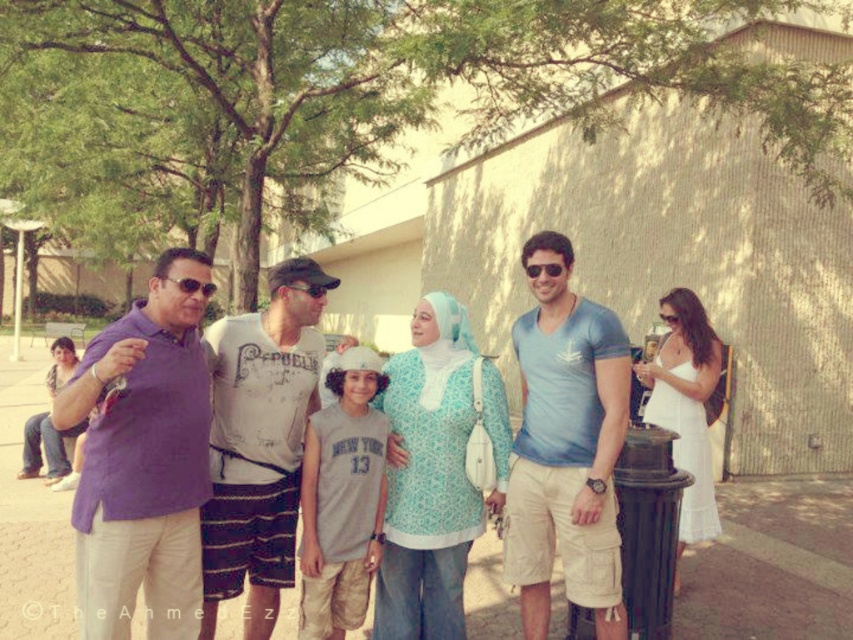
Question: Can you confirm if purple cotton shirt at left is positioned below purple cotton shirt at center?

Choices:
 (A) yes
 (B) no

Answer: (B)

Question: Is blue cotton t-shirt at center above distressed white t-shirt at center?

Choices:
 (A) yes
 (B) no

Answer: (A)

Question: Considering the real-world distances, which object is farthest from the purple cotton shirt at left?

Choices:
 (A) blue cotton t-shirt at center
 (B) distressed white t-shirt at center
 (C) sunglasses at center
 (D) transparent plastic goggles at center

Answer: (C)

Question: Which point is closer to the camera?

Choices:
 (A) distressed white t-shirt at center
 (B) sunglasses at center

Answer: (A)

Question: Is matte black sunglasses at left further to the viewer compared to sunglasses at center?

Choices:
 (A) no
 (B) yes

Answer: (A)

Question: Which point is closer to the camera taking this photo?

Choices:
 (A) (196, 602)
 (B) (534, 627)

Answer: (A)